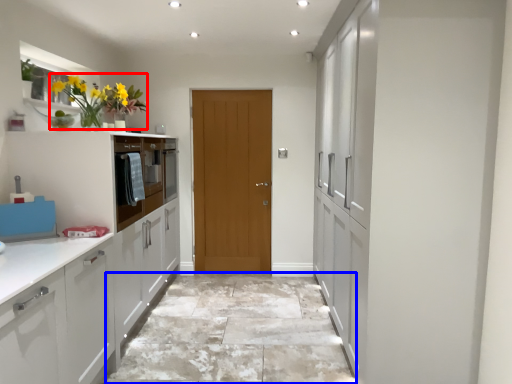
Question: Which object is further to the camera taking this photo, floral arrangement (highlighted by a red box) or granite (highlighted by a blue box)?

Choices:
 (A) floral arrangement
 (B) granite

Answer: (B)